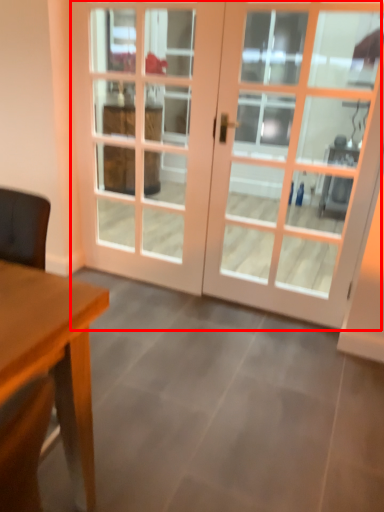
Question: From the image's perspective, considering the relative positions of door (annotated by the red box) and screen door in the image provided, where is door (annotated by the red box) located with respect to the staircase?

Choices:
 (A) below
 (B) above

Answer: (A)